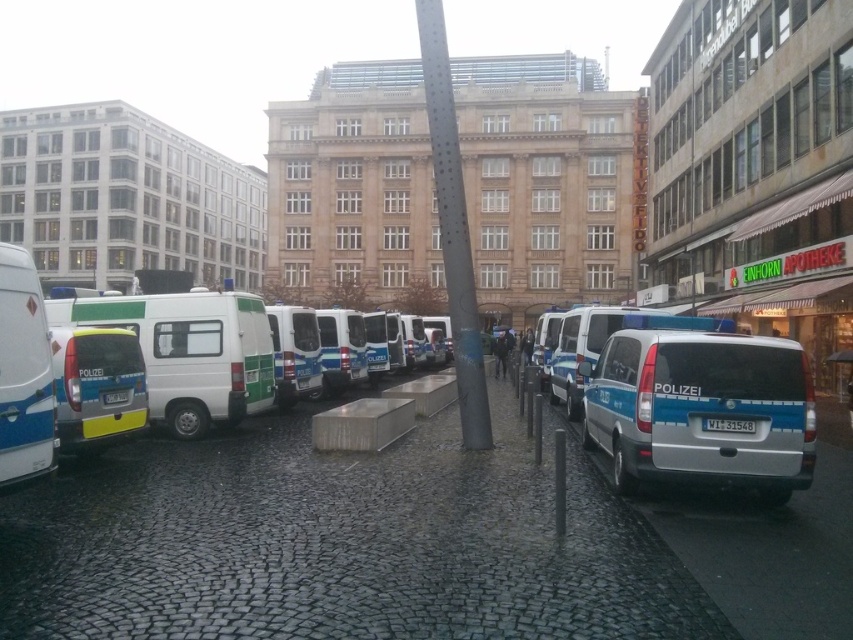
You are a delivery driver who needs to park your truck, which is 2 meters tall, in this street scene. There are two options available for parking spots next to the white matte van at center and the matte white van at left. Based on their heights, which parking spot would be safer to choose to avoid damaging your truck?

The white matte van at center is much taller than the matte white van at left. Since your truck is 2 meters tall, parking next to the matte white van at left would be safer to avoid damaging your truck, as it has a lower height compared to the taller white matte van at center.

You are a delivery driver needing to exit the street quickly. You see the white matte van at center and the matte white van at left. Which van is blocking your path more?

The matte white van at left is behind the white matte van at center, so the white matte van at center is blocking your path more as it is closer to you.